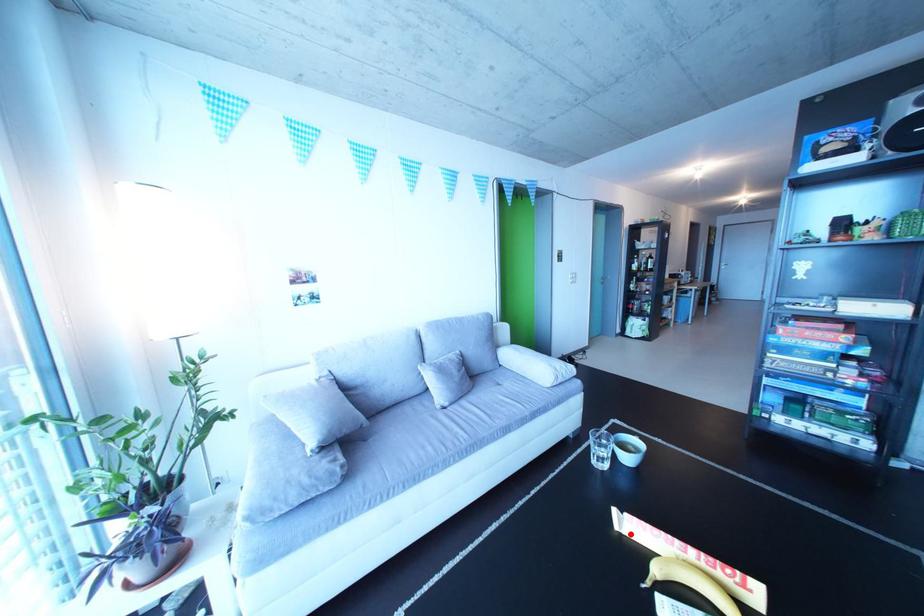
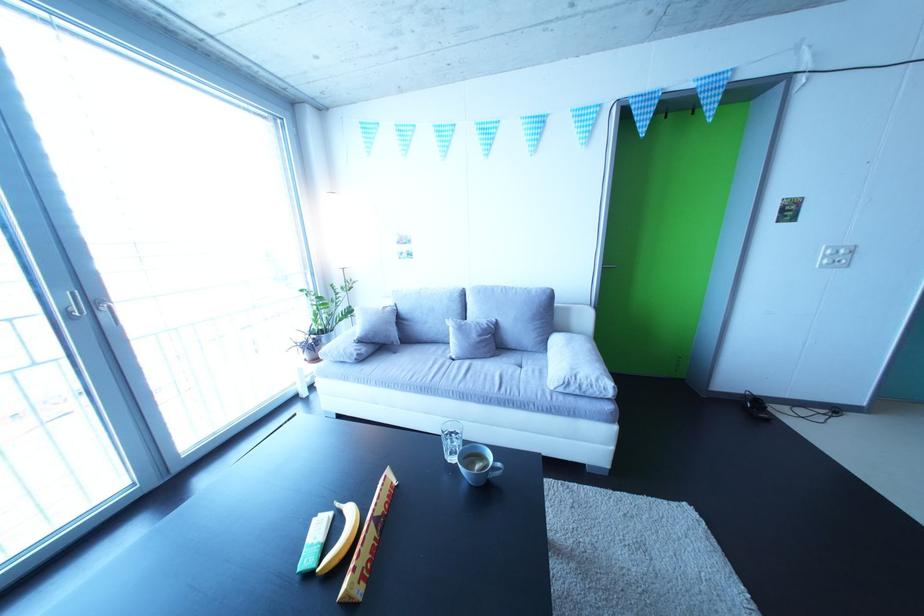
Locate, in the second image, the point that corresponds to the highlighted location in the first image.

(395, 487)